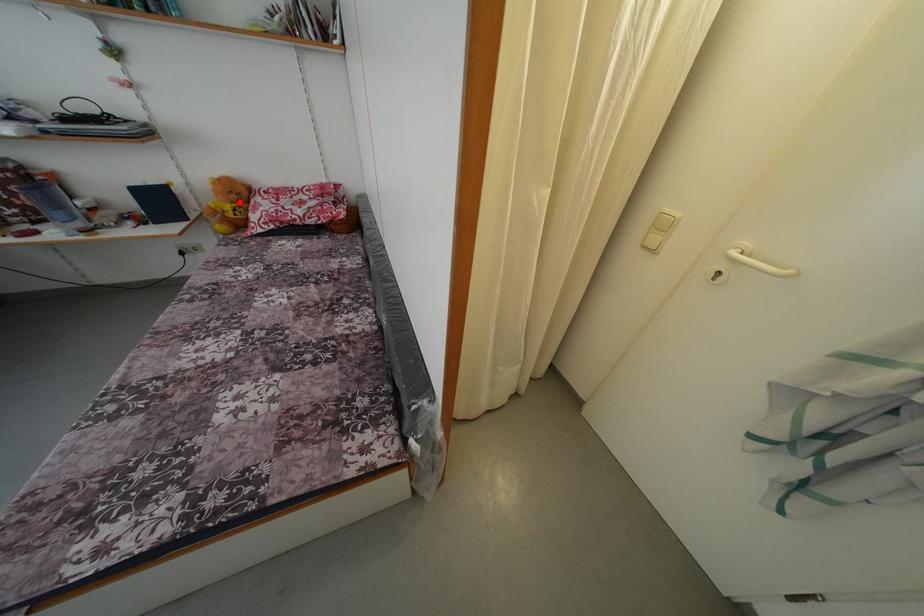
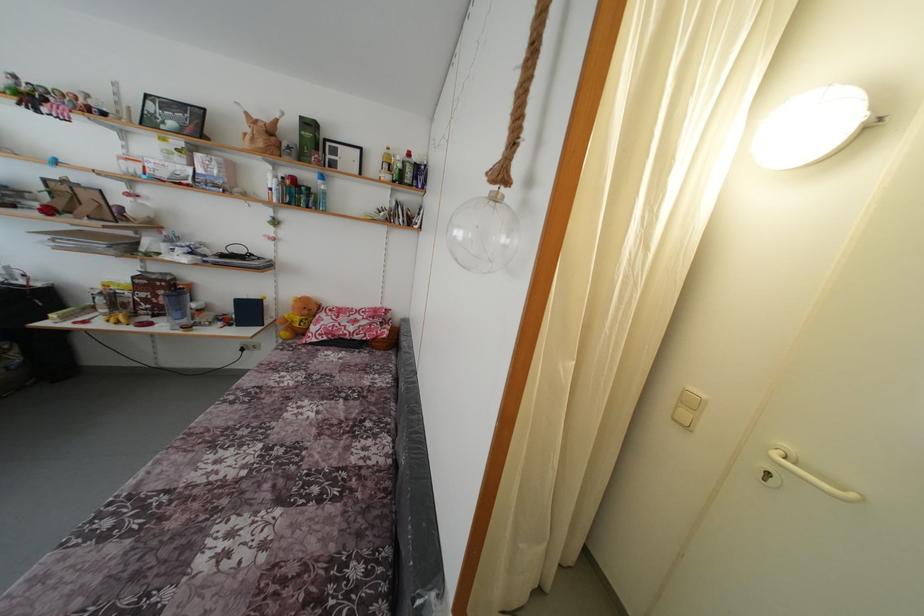
Question: I am providing you with two images of the same scene from different viewpoints. Given a red point in image1, look at the same physical point in image2. Is it:

Choices:
 (A) Closer to the viewpoint
 (B) Farther from the viewpoint

Answer: (B)